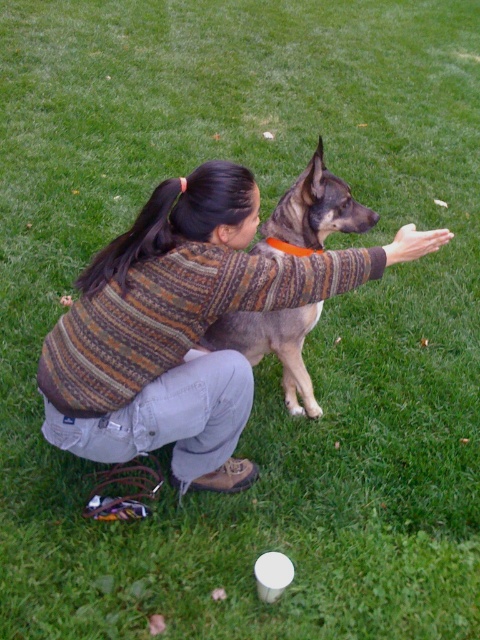
You are a photographer trying to capture a candid shot of the person and their dog. You notice the knitted sweater at center and the brown fur dog at center. Which object is positioned more to the left in the frame?

The knitted sweater at center is positioned to the left of the brown fur dog at center, so the knitted sweater at center is more to the left.

You are a photographer trying to capture a clear photo of the brown fur dog at center without the knitted sweater at center blocking the view. Based on their positions, can you adjust your angle to achieve this?

The knitted sweater at center is in front of the brown fur dog at center, so you can move to the side to get an angle where the brown fur dog at center is no longer blocked by the knitted sweater at center.